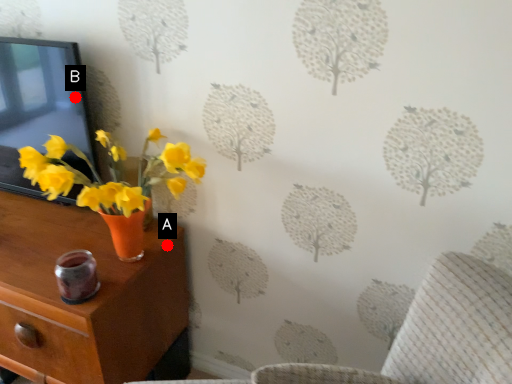
Question: Two points are circled on the image, labeled by A and B beside each circle. Among these points, which one is farthest from the camera?

Choices:
 (A) A is further
 (B) B is further

Answer: (A)